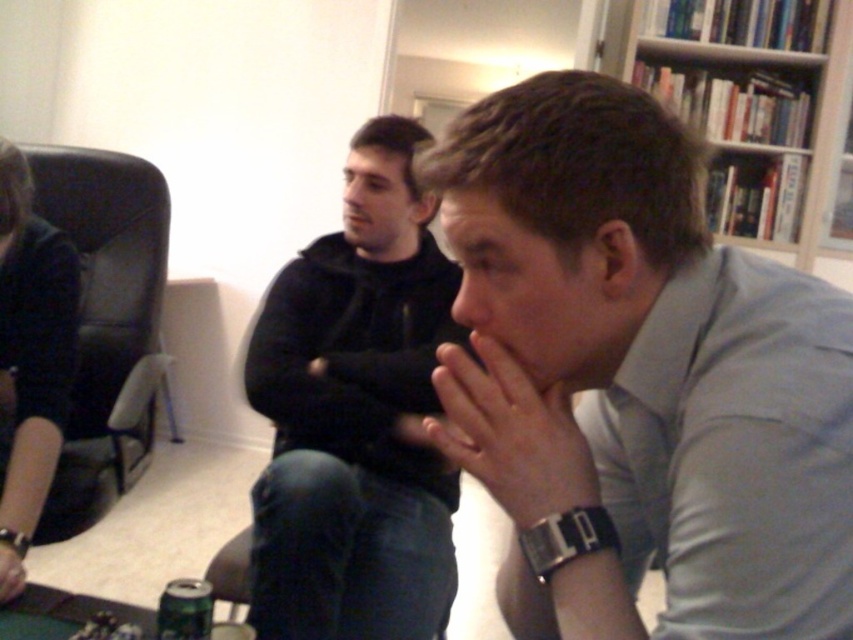
You are standing at the entrance of the room and want to sit in the black leather armchair at left. Based on its position, can you estimate how far it is from the entrance?

The black leather armchair at left is located at point (x=106, y=324), which would place it approximately in the middle of the left wall, so it should be about halfway between the entrance and the back wall if the entrance is near the front wall.

Looking at this image, in the scene described, there are a gray smooth shirt at center and a black leather armchair at left. From the perspective of someone standing at the entrance of the room, which object is positioned more to the right?

→ The gray smooth shirt at center is positioned to the right of the black leather armchair at left, so from the entrance perspective, the gray smooth shirt at center is more to the right.

You are organizing a charity event and need to hang a banner between the black hoodie at center and the black leather jacket at left. Since the banner requires a hook at the top, which object should you use as the anchor point for the banner?

The black hoodie at center should be used as the anchor point because it has a greater height than the black leather jacket at left, providing a higher position for the banner hook.